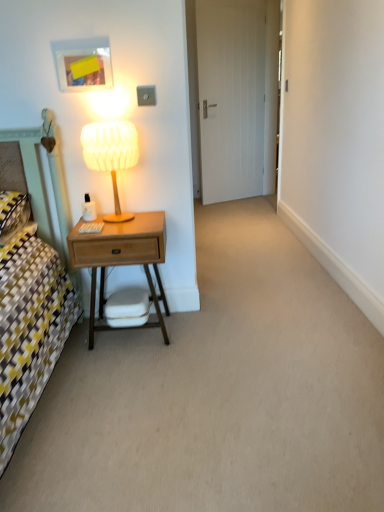
Identify the location of unoccupied region to the right of wooden nightstand at left. (211, 327).